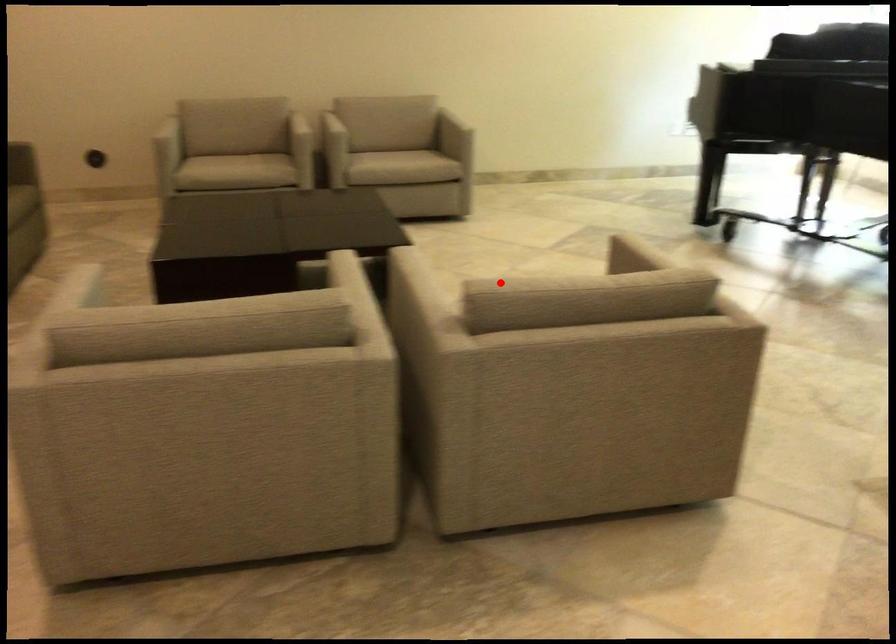
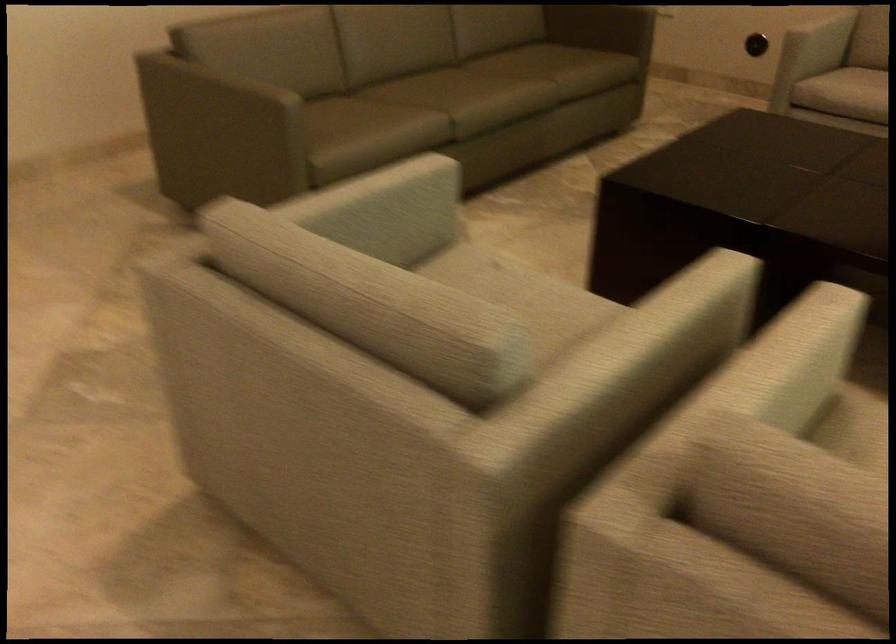
Question: I am providing you with two images of the same scene from different viewpoints. A red point is shown in image1. For the corresponding object point in image2, is it positioned nearer or farther from the camera?

Choices:
 (A) Nearer
 (B) Farther

Answer: (A)